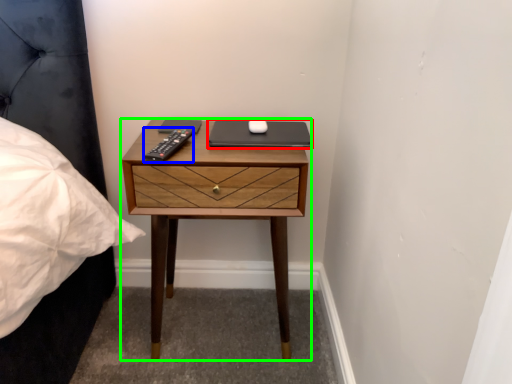
Question: Considering the real-world distances, which object is closest to laptop (highlighted by a red box)? remote (highlighted by a blue box) or nightstand (highlighted by a green box).

Choices:
 (A) remote
 (B) nightstand

Answer: (A)